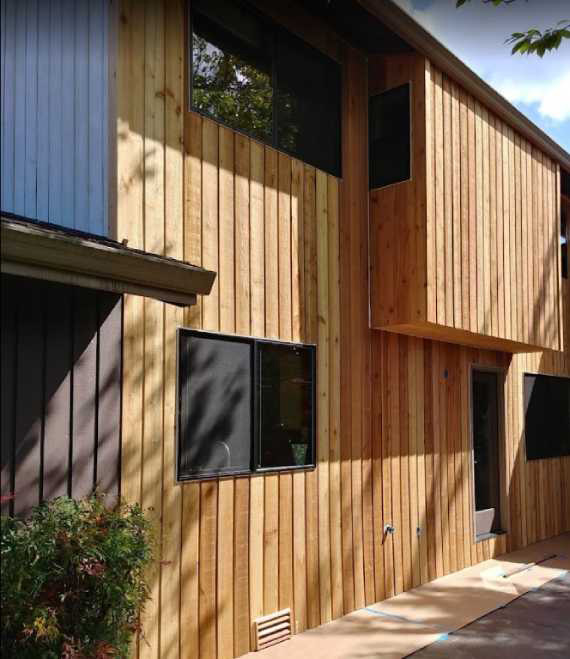
This screenshot has width=570, height=659. What are the coordinates of `screen` in the screenshot? It's located at (199, 436).